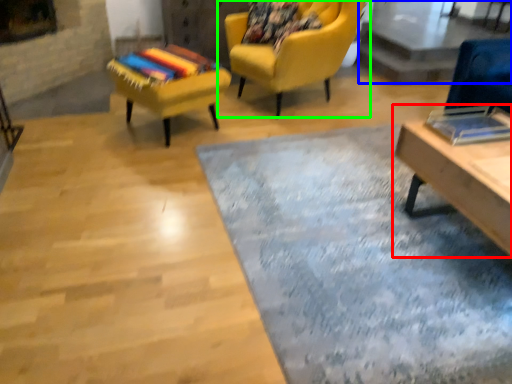
Question: Estimate the real-world distances between objects in this image. Which object is farther from table (highlighted by a red box), glass table (highlighted by a blue box) or chair (highlighted by a green box)?

Choices:
 (A) glass table
 (B) chair

Answer: (A)